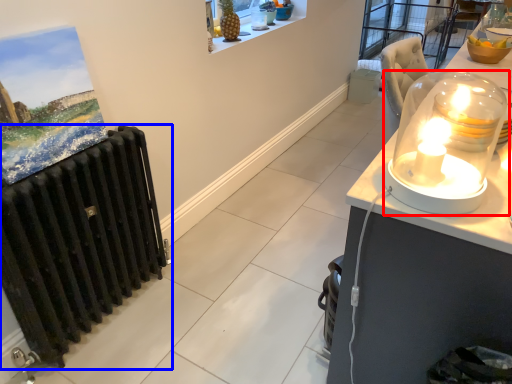
Question: Which object appears closest to the camera in this image, candle holder (highlighted by a red box) or radiator (highlighted by a blue box)?

Choices:
 (A) candle holder
 (B) radiator

Answer: (A)